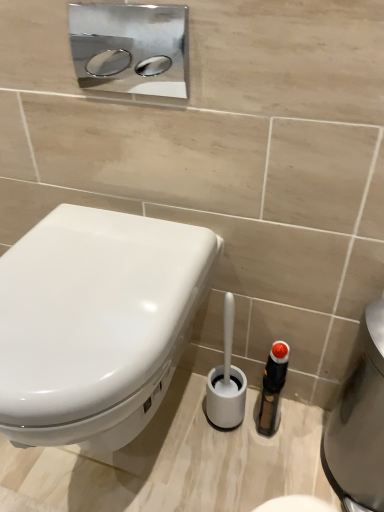
Question: Is silver metallic water heater at lower right positioned beyond the bounds of white glossy toilet at left?

Choices:
 (A) yes
 (B) no

Answer: (A)

Question: Considering the relative sizes of silver metallic water heater at lower right and white glossy toilet at left in the image provided, is silver metallic water heater at lower right taller than white glossy toilet at left?

Choices:
 (A) yes
 (B) no

Answer: (A)

Question: Is silver metallic water heater at lower right aimed at white glossy toilet at left?

Choices:
 (A) yes
 (B) no

Answer: (B)

Question: From a real-world perspective, is silver metallic water heater at lower right under white glossy toilet at left?

Choices:
 (A) yes
 (B) no

Answer: (A)

Question: Can you confirm if silver metallic water heater at lower right is smaller than white glossy toilet at left?

Choices:
 (A) no
 (B) yes

Answer: (B)

Question: Visually, is white plastic toilet brush at lower center positioned to the left or to the right of silver metallic water heater at lower right?

Choices:
 (A) right
 (B) left

Answer: (B)

Question: Considering their positions, is white plastic toilet brush at lower center located in front of or behind silver metallic water heater at lower right?

Choices:
 (A) behind
 (B) front

Answer: (A)

Question: Based on their sizes in the image, would you say white plastic toilet brush at lower center is bigger or smaller than silver metallic water heater at lower right?

Choices:
 (A) small
 (B) big

Answer: (A)

Question: In terms of height, does white plastic toilet brush at lower center look taller or shorter compared to silver metallic water heater at lower right?

Choices:
 (A) short
 (B) tall

Answer: (A)

Question: From the image's perspective, is white plastic toilet brush at lower center above or below white glossy toilet at left?

Choices:
 (A) below
 (B) above

Answer: (A)

Question: Is white plastic toilet brush at lower center taller or shorter than white glossy toilet at left?

Choices:
 (A) tall
 (B) short

Answer: (B)

Question: Based on their sizes in the image, would you say white plastic toilet brush at lower center is bigger or smaller than white glossy toilet at left?

Choices:
 (A) small
 (B) big

Answer: (A)

Question: Is white plastic toilet brush at lower center wider or thinner than white glossy toilet at left?

Choices:
 (A) wide
 (B) thin

Answer: (B)

Question: From the image's perspective, is white glossy toilet at left located above or below white plastic toilet brush at lower center?

Choices:
 (A) above
 (B) below

Answer: (A)

Question: Relative to white plastic toilet brush at lower center, is white glossy toilet at left in front or behind?

Choices:
 (A) behind
 (B) front

Answer: (B)